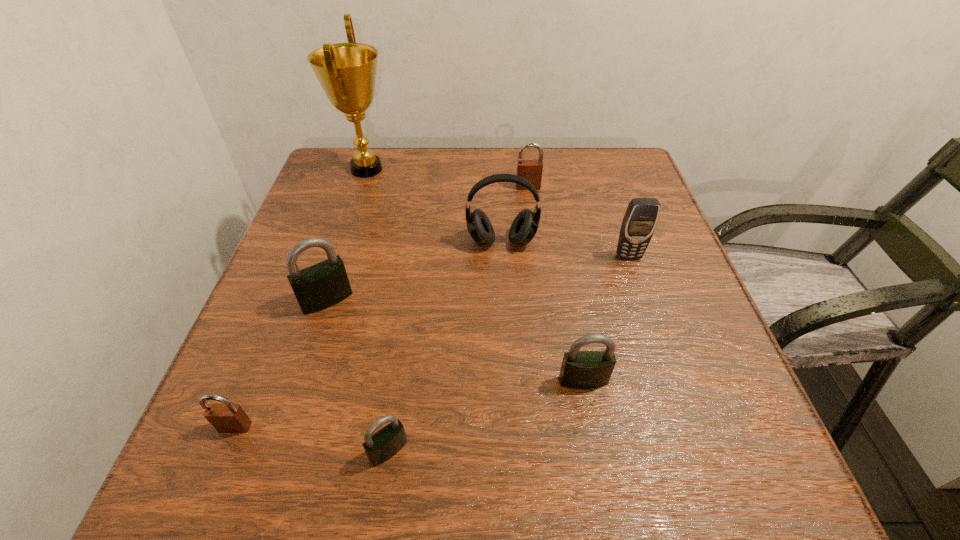
You are a GUI agent. You are given a task and a screenshot of the screen. Output one action in this format:
    pyautogui.click(x=<x>, y=<y>)
    Task: Click on the vacant space at the far left corner of the desktop
    The height and width of the screenshot is (540, 960).
    Given the screenshot: What is the action you would take?
    pyautogui.click(x=327, y=151)

Image resolution: width=960 pixels, height=540 pixels. I want to click on blank space at the far right corner of the desktop, so click(635, 172).

Locate an element on the screen. free space at the near right corner of the desktop is located at coordinates (728, 468).

Locate an element on the screen. vacant point located between the fifth object from right to left and the second nearest black padlock is located at coordinates (486, 416).

The width and height of the screenshot is (960, 540). What are the coordinates of `empty location between the fourth nearest padlock and the bigger brown padlock` in the screenshot? It's located at (427, 244).

Locate an element on the screen. The height and width of the screenshot is (540, 960). free space between the nearer brown padlock and the smallest black padlock is located at coordinates (312, 438).

Find the location of a particular element. empty space that is in between the headset and the fourth nearest padlock is located at coordinates (x=414, y=271).

This screenshot has height=540, width=960. I want to click on blank region between the headset and the farthest black padlock, so click(414, 271).

This screenshot has width=960, height=540. Identify the location of empty location between the nearer brown padlock and the nearest object. (312, 438).

Find the location of a particular element. The width and height of the screenshot is (960, 540). unoccupied position between the nearer brown padlock and the fourth nearest padlock is located at coordinates (281, 363).